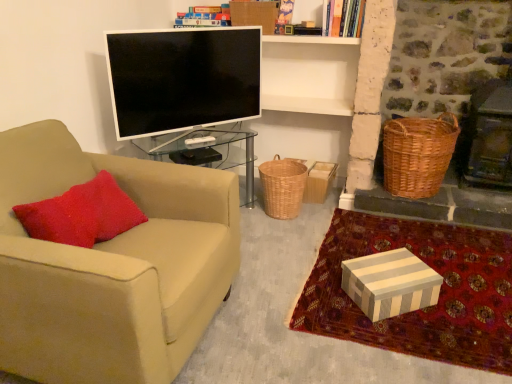
This screenshot has width=512, height=384. Find the location of `free space to the left of white striped fabric at lower right`. free space to the left of white striped fabric at lower right is located at coordinates (272, 284).